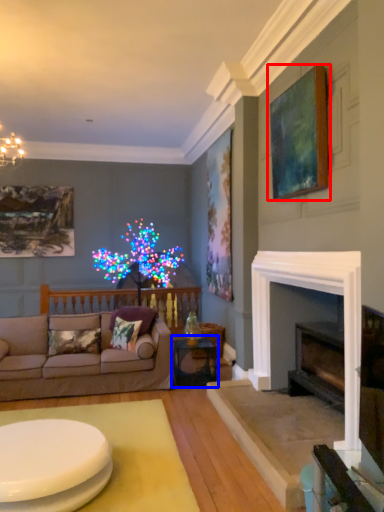
Question: Which of the following is the farthest to the observer, picture frame (highlighted by a red box) or table (highlighted by a blue box)?

Choices:
 (A) picture frame
 (B) table

Answer: (B)